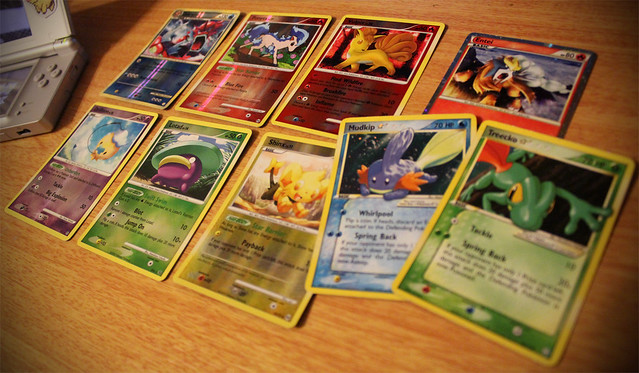
This screenshot has height=373, width=639. What are the coordinates of `playing cards` in the screenshot? It's located at (86, 168), (169, 48), (158, 182), (233, 79), (268, 234), (312, 96), (360, 188), (473, 248), (507, 92).